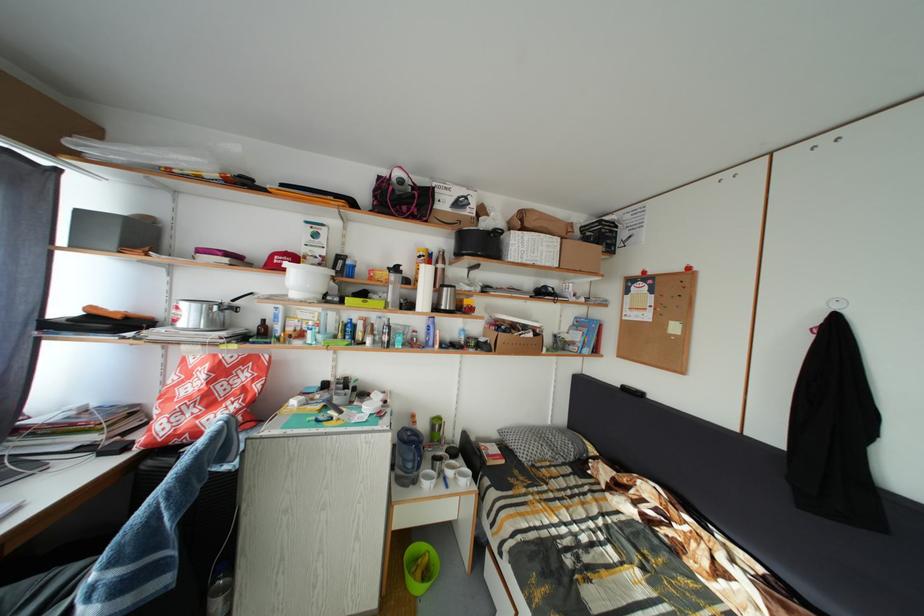
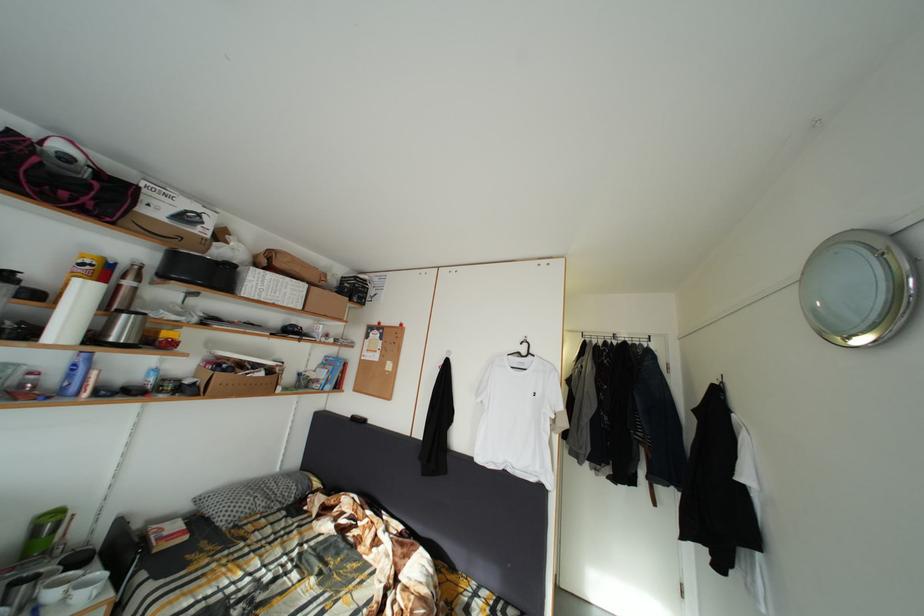
The point at (448, 267) is marked in the first image. Where is the corresponding point in the second image?

(140, 283)